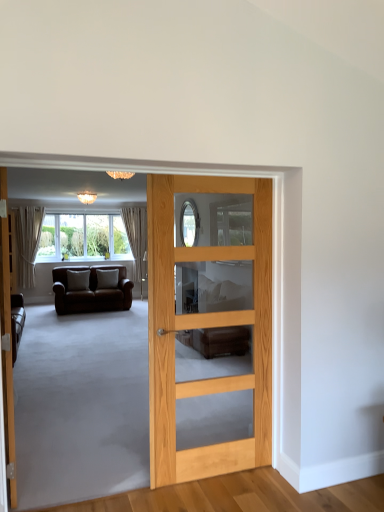
Question: Should I look upward or downward to see natural wood door at center?

Choices:
 (A) down
 (B) up

Answer: (A)